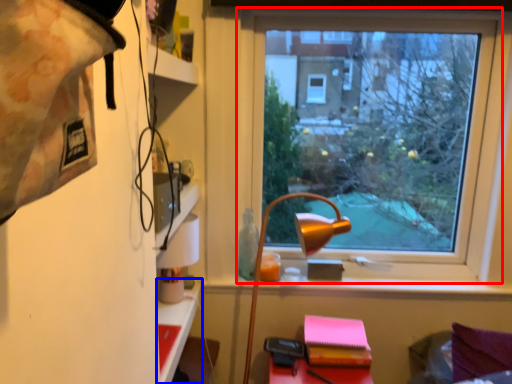
Question: Which object appears closest to the camera in this image, window (highlighted by a red box) or table (highlighted by a blue box)?

Choices:
 (A) window
 (B) table

Answer: (B)